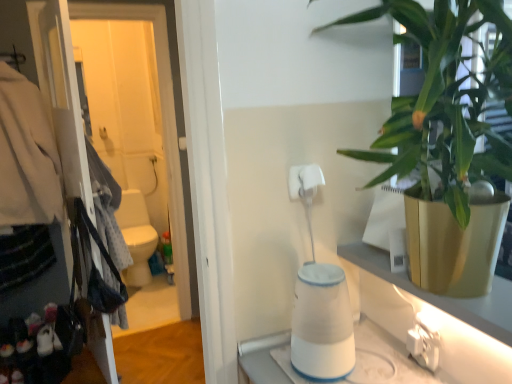
Where is `vacant space to the right of matte black coat hanger at left`? vacant space to the right of matte black coat hanger at left is located at coordinates (175, 354).